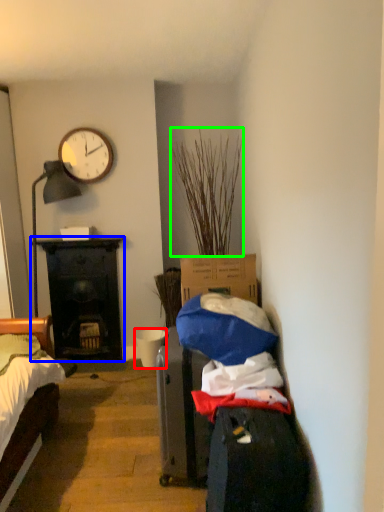
Question: Which is farther away from bucket (highlighted by a red box)? desk (highlighted by a blue box) or plant (highlighted by a green box)?

Choices:
 (A) desk
 (B) plant

Answer: (B)